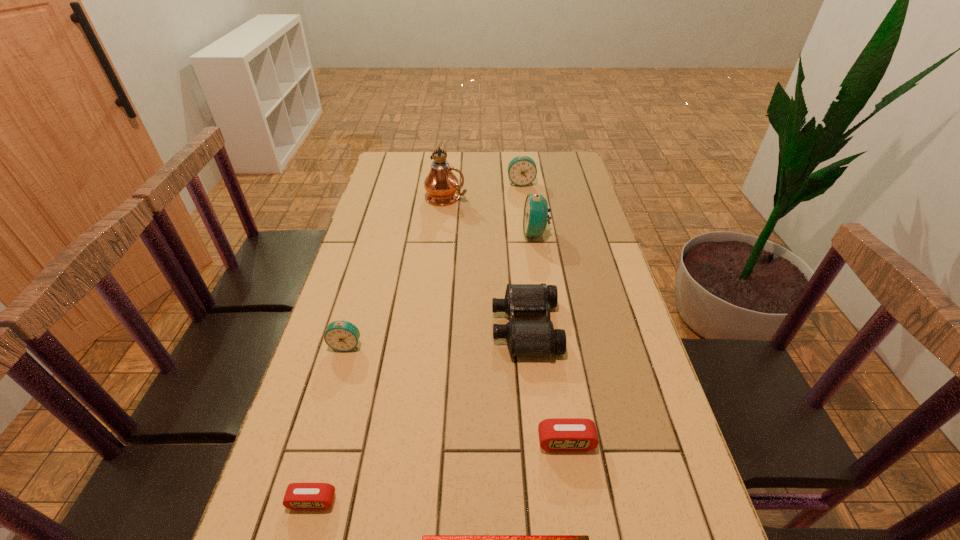
In order to click on oil lamp in this screenshot , I will do `click(443, 189)`.

Find the location of a particular element. the tallest object is located at coordinates [x=443, y=189].

The image size is (960, 540). Identify the location of the second nearest blue alarm clock. (535, 218).

In order to click on the second farthest alarm clock in this screenshot , I will do `click(535, 218)`.

Image resolution: width=960 pixels, height=540 pixels. Identify the location of the farthest alarm clock. click(x=522, y=171).

Locate an element on the screen. the second smallest blue alarm clock is located at coordinates (522, 171).

The image size is (960, 540). I want to click on the third farthest alarm clock, so click(x=340, y=335).

Locate an element on the screen. The image size is (960, 540). the leftmost blue alarm clock is located at coordinates (340, 335).

This screenshot has height=540, width=960. In order to click on binoculars in this screenshot , I will do `click(524, 338)`.

Identify the location of the bigger pink alarm clock. (557, 434).